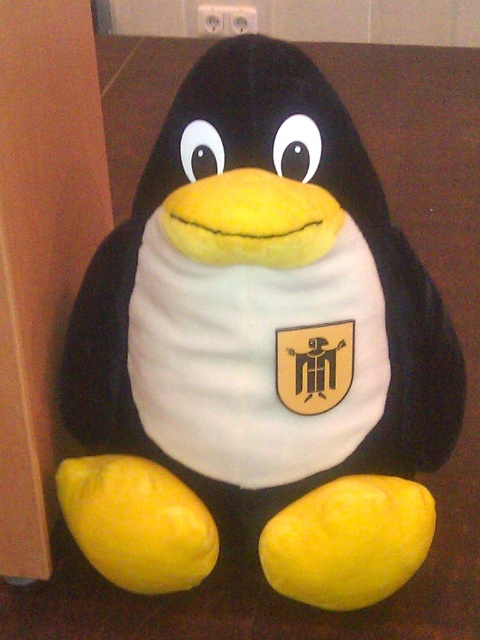
You are organizing a fruit display and need to place the yellow matte lemon at lower center and the yellow matte lemon at lower left. Which lemon is positioned closer to the front of the display?

The yellow matte lemon at lower center is closer to the viewer than the yellow matte lemon at lower left, so it is positioned closer to the front of the display.

You are arranging fruits on a table and see the yellow matte lemon at lower center and the yellow matte lemon at lower left. Which lemon is positioned more to the right side of the table?

The yellow matte lemon at lower center is positioned more to the right side of the table than the yellow matte lemon at lower left.